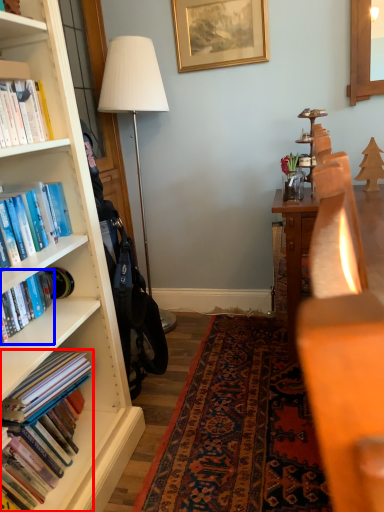
Question: Which object is further to the camera taking this photo, book (highlighted by a red box) or book (highlighted by a blue box)?

Choices:
 (A) book
 (B) book

Answer: (B)